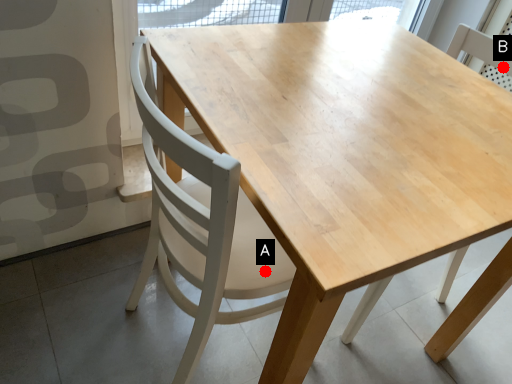
Question: Two points are circled on the image, labeled by A and B beside each circle. Among these points, which one is nearest to the camera?

Choices:
 (A) A is closer
 (B) B is closer

Answer: (A)